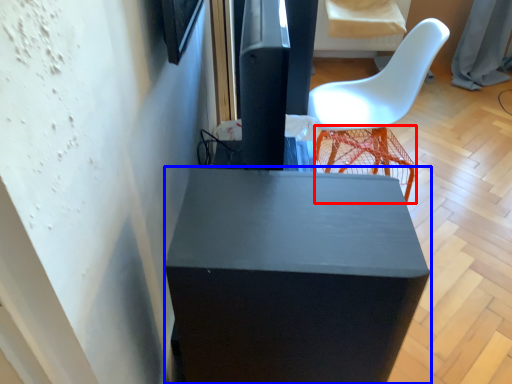
Question: Which point is further to the camera, bar stool (highlighted by a red box) or furniture (highlighted by a blue box)?

Choices:
 (A) bar stool
 (B) furniture

Answer: (A)